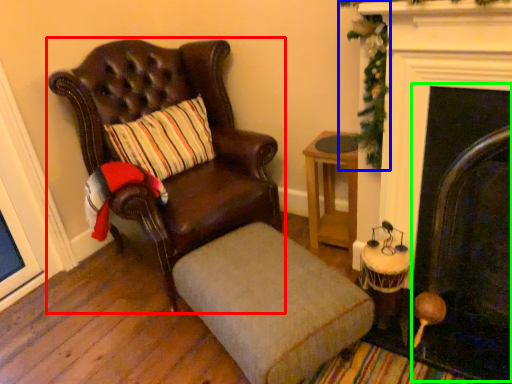
Question: Which object is the closest to the chair (highlighted by a red box)? Choose among these: christmas decoration (highlighted by a blue box) or fireplace (highlighted by a green box).

Choices:
 (A) christmas decoration
 (B) fireplace

Answer: (A)